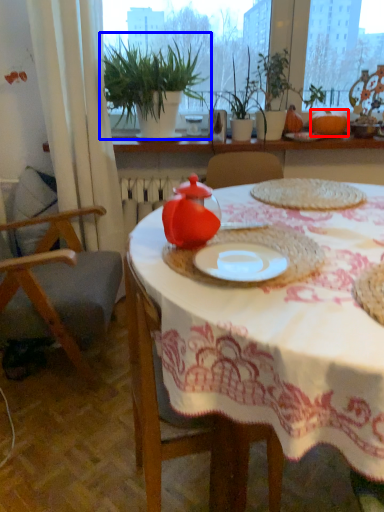
Question: Which object appears closest to the camera in this image, pumpkin (highlighted by a red box) or houseplant (highlighted by a blue box)?

Choices:
 (A) pumpkin
 (B) houseplant

Answer: (B)